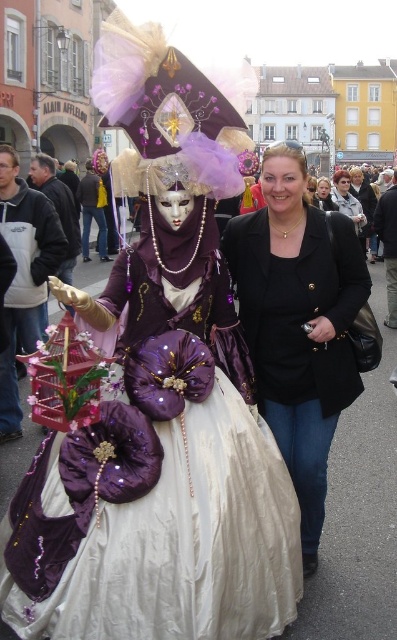
Question: Does purple satin dress at center lie behind matte black jacket at center?

Choices:
 (A) yes
 (B) no

Answer: (B)

Question: Can you confirm if matte black jacket at center is smaller than black matte jacket at center?

Choices:
 (A) yes
 (B) no

Answer: (B)

Question: Does purple satin dress at center have a greater width compared to matte black jacket at center?

Choices:
 (A) yes
 (B) no

Answer: (B)

Question: Based on their relative distances, which object is farther from the purple satin dress at center?

Choices:
 (A) black matte jacket at center
 (B) matte black jacket at center
 (C) black matte blazer at center

Answer: (A)

Question: Which of the following is the closest to the observer?

Choices:
 (A) black matte blazer at center
 (B) purple satin dress at center
 (C) matte black jacket at center
 (D) black matte jacket at center

Answer: (B)

Question: Considering the real-world distances, which object is closest to the matte black jacket at center?

Choices:
 (A) black matte jacket at center
 (B) purple satin dress at center
 (C) black matte blazer at center

Answer: (A)